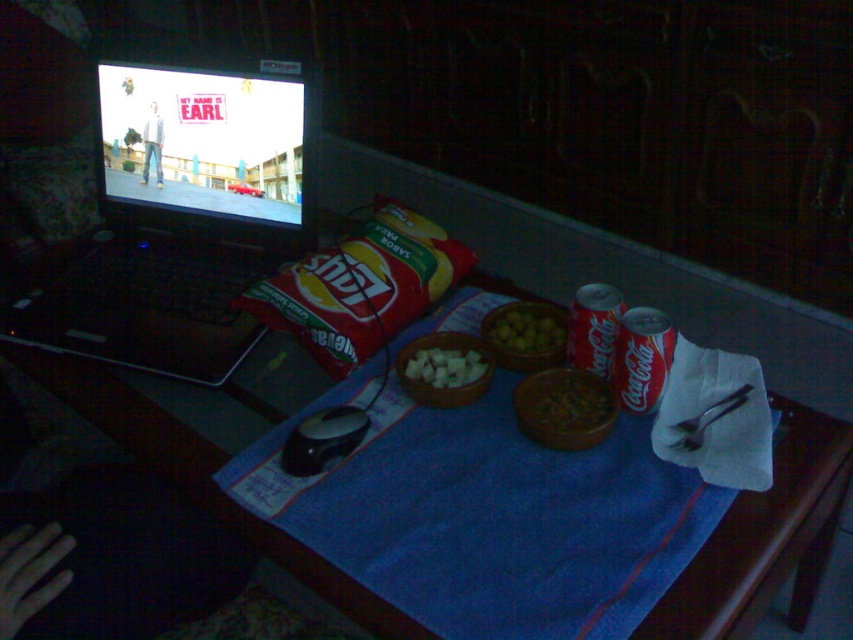
Can you confirm if blue fabric tablecloth at center is thinner than denim jeans at left?

Incorrect, blue fabric tablecloth at center's width is not less than denim jeans at left's.

Can you confirm if blue fabric tablecloth at center is smaller than denim jeans at left?

Incorrect, blue fabric tablecloth at center is not smaller in size than denim jeans at left.

Identify the location of blue fabric tablecloth at center. (488, 515).

Between brown matte bowl at center and green matte olives at center, which one has more height?

green matte olives at center is taller.

You are a GUI agent. You are given a task and a screenshot of the screen. Output one action in this format:
    pyautogui.click(x=<x>, y=<y>)
    Task: Click on the brown matte bowl at center
    The height and width of the screenshot is (640, 853).
    Given the screenshot: What is the action you would take?
    point(570,403)

Is point (660, 595) more distant than point (560, 353)?

No, (660, 595) is in front of (560, 353).

Between point (357, 472) and point (547, 316), which one is positioned in front?

Point (357, 472) is in front.

The height and width of the screenshot is (640, 853). I want to click on blue fabric tablecloth at center, so click(488, 515).